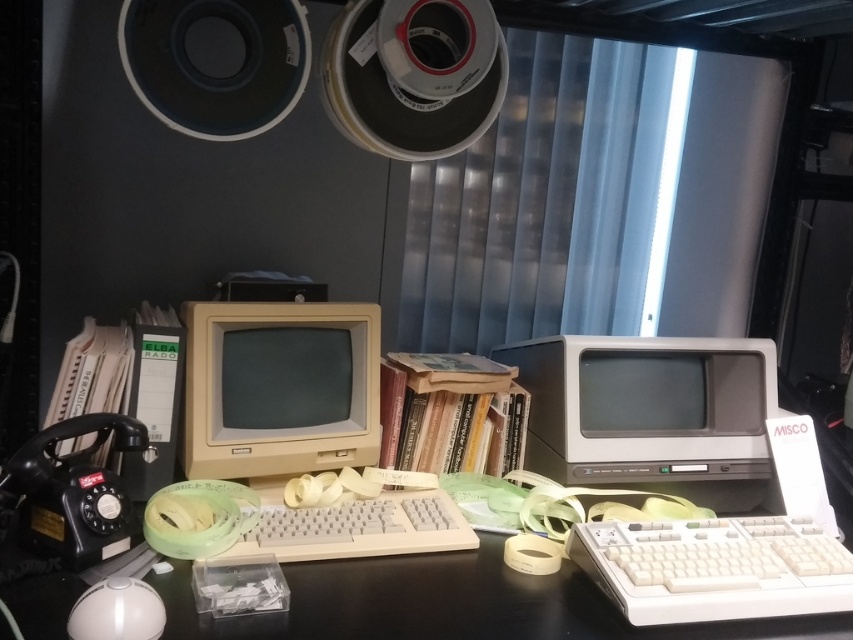
From the picture: Can you confirm if white plastic keyboard at lower right is positioned to the left of white matte tape at center?

No, white plastic keyboard at lower right is not to the left of white matte tape at center.

Does point (695, 592) come farther from viewer compared to point (543, 545)?

No, it is in front of (543, 545).

Is point (712, 536) positioned in front of point (505, 550)?

Yes, it is.

Locate an element on the screen. The width and height of the screenshot is (853, 640). white plastic keyboard at lower right is located at coordinates (712, 568).

Between matte gray monitor at center and white matte tape at center, which one is positioned higher?

Positioned higher is matte gray monitor at center.

Does matte gray monitor at center appear over white matte tape at center?

Yes.

Between point (607, 429) and point (517, 570), which one is positioned in front?

Point (517, 570) is in front.

The height and width of the screenshot is (640, 853). Find the location of `matte gray monitor at center`. matte gray monitor at center is located at coordinates (646, 408).

Which is more to the left, white plastic keyboard at center or white glossy mouse at lower left?

white glossy mouse at lower left

Does point (314, 532) come behind point (125, 582)?

Yes.

Where is `white plastic keyboard at center`? The width and height of the screenshot is (853, 640). white plastic keyboard at center is located at coordinates (355, 528).

Where is `white plastic keyboard at center`? The width and height of the screenshot is (853, 640). white plastic keyboard at center is located at coordinates (355, 528).